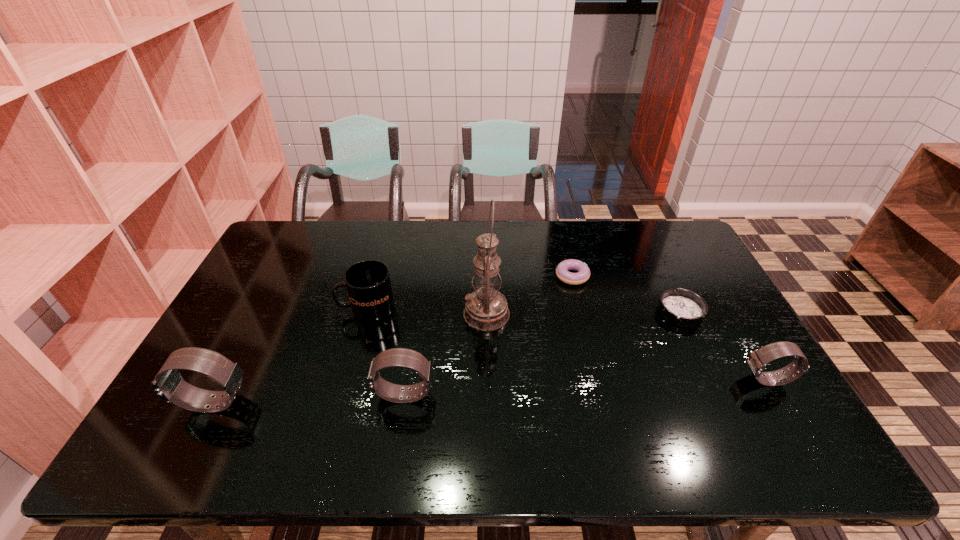
Please point a location where one more watch can be added evenly. Please provide its 2D coordinates. Your answer should be formatted as a tuple, i.e. [(x, y)], where the tuple contains the x and y coordinates of a point satisfying the conditions above.

[(588, 387)]